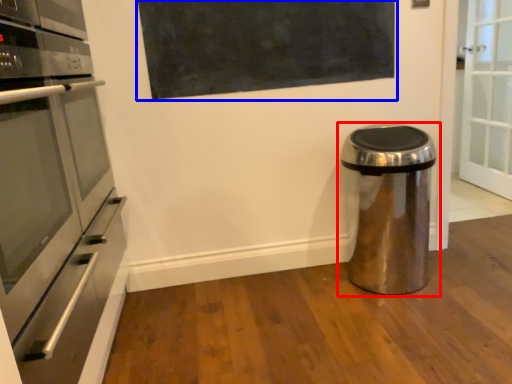
Question: Which point is closer to the camera, waste container (highlighted by a red box) or bulletin board (highlighted by a blue box)?

Choices:
 (A) waste container
 (B) bulletin board

Answer: (A)